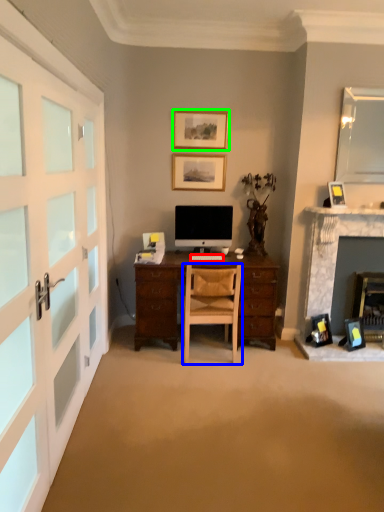
Question: Which object is the farthest from computer keyboard (highlighted by a red box)? Choose among these: chair (highlighted by a blue box) or picture frame (highlighted by a green box).

Choices:
 (A) chair
 (B) picture frame

Answer: (B)